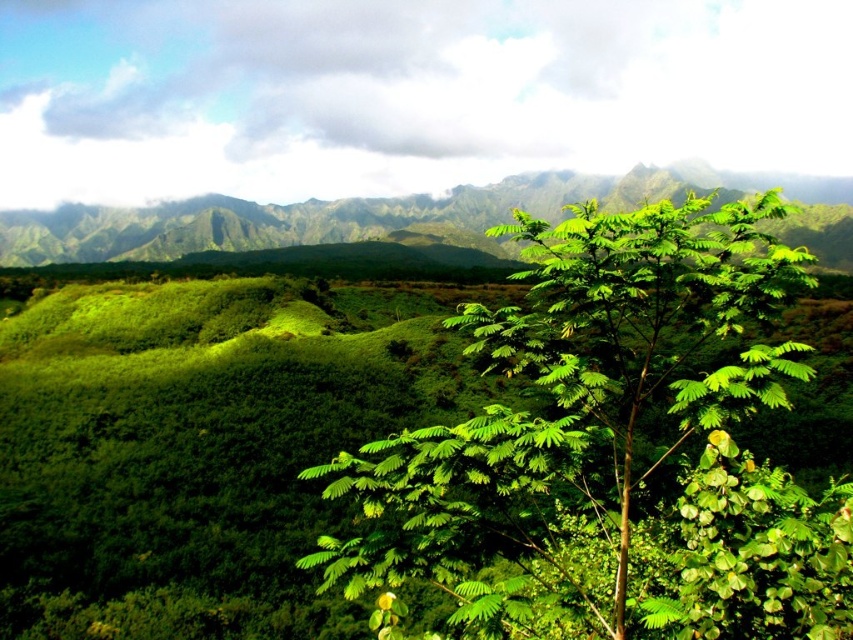
Question: Can you confirm if green leafy tree at center is positioned to the left of green leafy vegetation at center?

Choices:
 (A) yes
 (B) no

Answer: (B)

Question: Which of the following is the closest to the observer?

Choices:
 (A) green leafy vegetation at center
 (B) green leafy tree at center

Answer: (B)

Question: Is green leafy tree at center to the right of green leafy vegetation at center from the viewer's perspective?

Choices:
 (A) no
 (B) yes

Answer: (B)

Question: Does green leafy tree at center come in front of green leafy vegetation at center?

Choices:
 (A) yes
 (B) no

Answer: (A)

Question: Which object is closer to the camera taking this photo?

Choices:
 (A) green leafy vegetation at center
 (B) green leafy tree at center

Answer: (B)